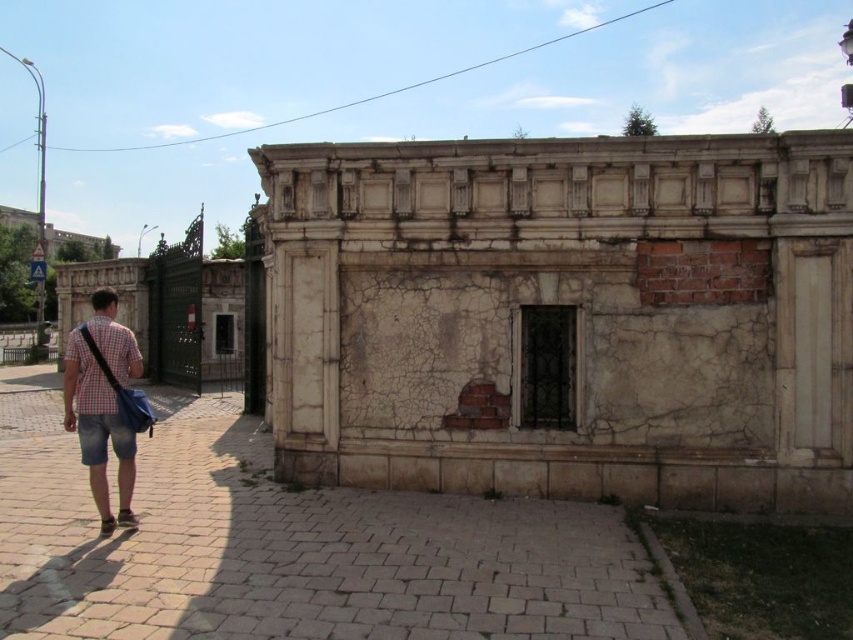
Between brick pavement at lower center and checkered fabric shirt at left, which one has more height?

With more height is checkered fabric shirt at left.

Is brick pavement at lower center positioned before checkered fabric shirt at left?

Yes.

Between point (250, 440) and point (106, 515), which one is positioned in front?

Point (106, 515)

Where is `brick pavement at lower center`? Image resolution: width=853 pixels, height=640 pixels. brick pavement at lower center is located at coordinates pyautogui.click(x=292, y=547).